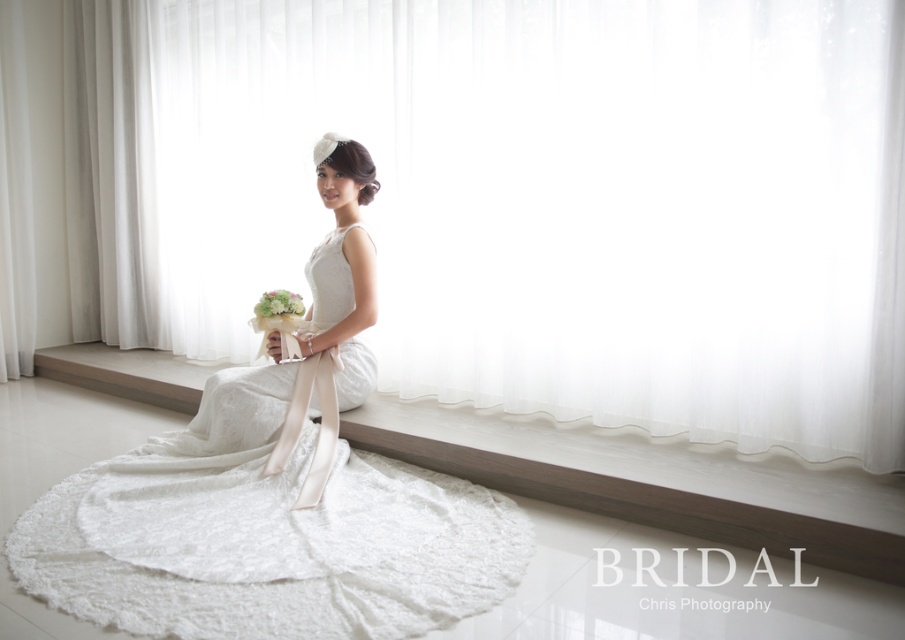
Question: Which object is farther from the camera taking this photo?

Choices:
 (A) white lace dress at center
 (B) white sheer curtain at center
 (C) green fabric bouquet at center

Answer: (C)

Question: Is white sheer curtain at center above white lace dress at center?

Choices:
 (A) yes
 (B) no

Answer: (A)

Question: Does white sheer curtain at center appear under white lace dress at center?

Choices:
 (A) yes
 (B) no

Answer: (B)

Question: Which of these objects is positioned closest to the green fabric bouquet at center?

Choices:
 (A) white sheer curtain at center
 (B) white lace dress at center

Answer: (B)

Question: Which object is closer to the camera taking this photo?

Choices:
 (A) white sheer curtain at center
 (B) white lace dress at center
 (C) green fabric bouquet at center

Answer: (B)

Question: Is white lace dress at center above green fabric bouquet at center?

Choices:
 (A) yes
 (B) no

Answer: (B)